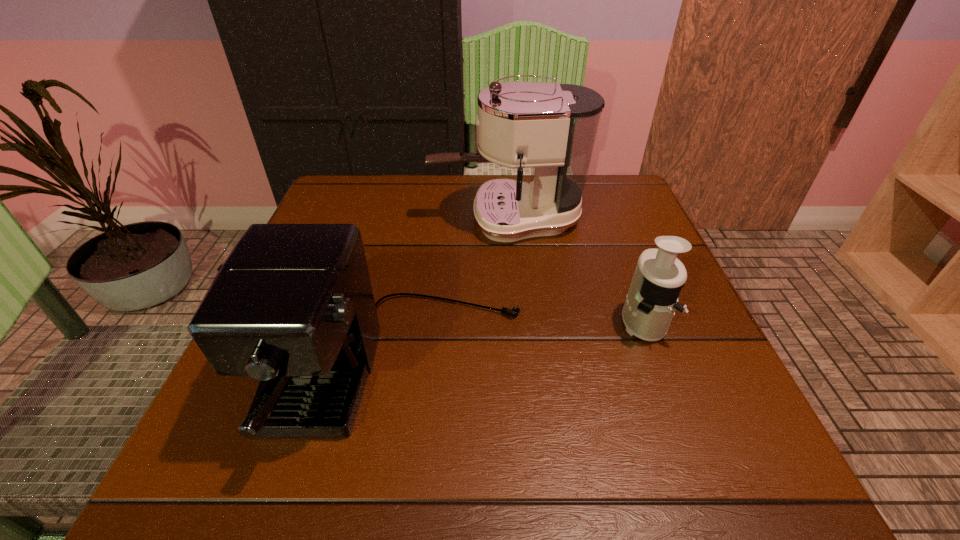
Where is `free space that satisfies the following two spatial constraints: 1. on the front-facing side of the tallest object; 2. on the right side of the juicer`? free space that satisfies the following two spatial constraints: 1. on the front-facing side of the tallest object; 2. on the right side of the juicer is located at coordinates (515, 321).

At what (x,y) coordinates should I click in order to perform the action: click on free space in the image that satisfies the following two spatial constraints: 1. on the back side of the juicer; 2. on the front-facing side of the farther coffee maker. Please return your answer as a coordinate pair (x, y). Looking at the image, I should click on (604, 219).

Find the location of a particular element. vacant area that satisfies the following two spatial constraints: 1. on the back side of the juicer; 2. on the front-facing side of the farthest object is located at coordinates (604, 219).

Locate an element on the screen. The image size is (960, 540). free location that satisfies the following two spatial constraints: 1. on the front-facing side of the farthest object; 2. on the front-facing side of the second tallest object is located at coordinates (519, 370).